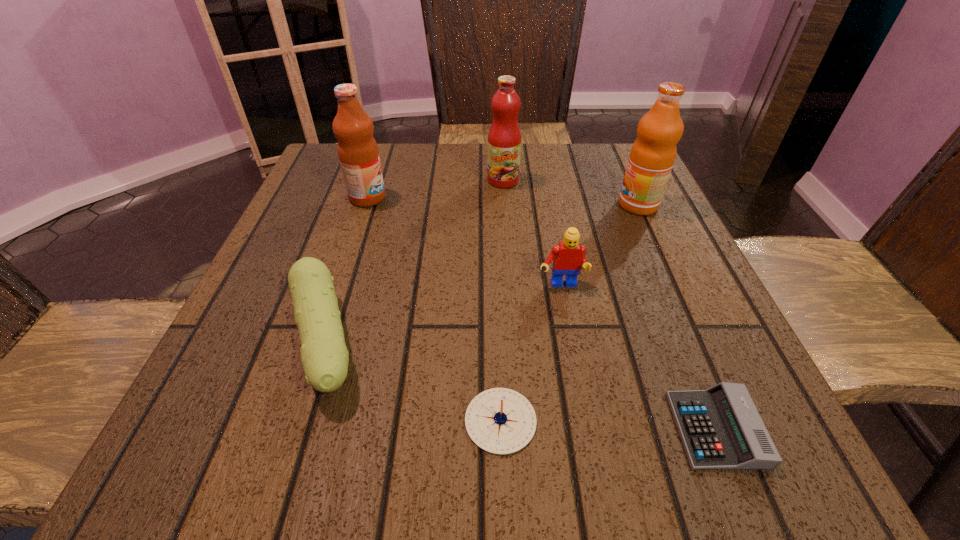
Locate an element on the screen. cucumber that is at the left edge is located at coordinates (324, 356).

Find the location of a particular element. The width and height of the screenshot is (960, 540). fruit juice located in the right edge section of the desktop is located at coordinates (652, 156).

Locate an element on the screen. The height and width of the screenshot is (540, 960). calculator that is at the right edge is located at coordinates click(721, 429).

Find the location of a particular element. The width and height of the screenshot is (960, 540). object situated at the far left corner is located at coordinates (358, 153).

The width and height of the screenshot is (960, 540). Find the location of `object located in the far right corner section of the desktop`. object located in the far right corner section of the desktop is located at coordinates (652, 156).

Locate an element on the screen. This screenshot has height=540, width=960. object located at the near right corner is located at coordinates pos(721,429).

The image size is (960, 540). I want to click on vacant space at the far edge of the desktop, so click(x=461, y=164).

Locate an element on the screen. Image resolution: width=960 pixels, height=540 pixels. vacant space at the near edge of the desktop is located at coordinates point(466,464).

What are the coordinates of `vacant space at the left edge of the desktop` in the screenshot? It's located at (246, 301).

The width and height of the screenshot is (960, 540). Find the location of `free space at the right edge of the desktop`. free space at the right edge of the desktop is located at coordinates (656, 244).